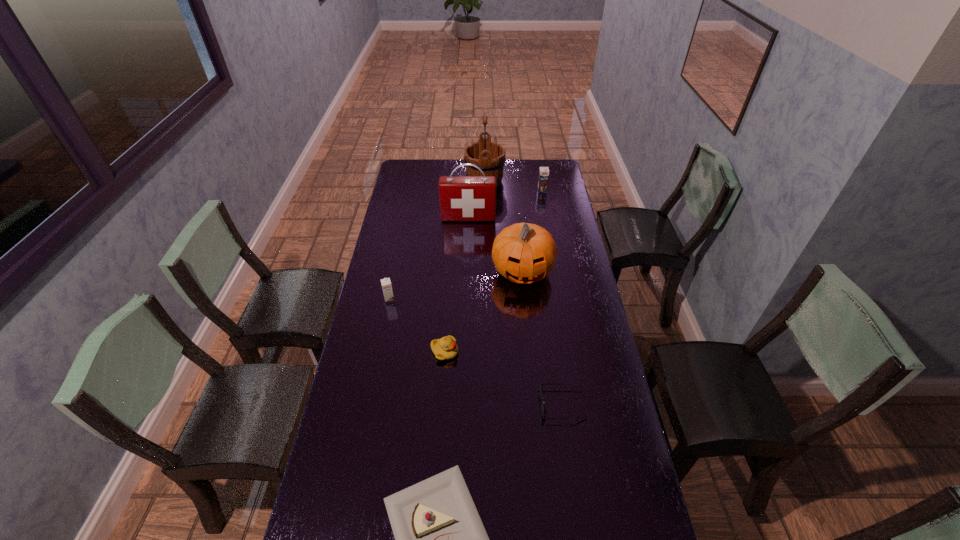
At what (x,y) coordinates should I click in order to perform the action: click on the second nearest object. Please return your answer as a coordinate pair (x, y). Image resolution: width=960 pixels, height=540 pixels. Looking at the image, I should click on (544, 411).

Locate an element on the screen. vacant space located on the left of the tallest object is located at coordinates (432, 181).

This screenshot has width=960, height=540. Find the location of `vacant point located 0.370m on the front face of the third farthest object`. vacant point located 0.370m on the front face of the third farthest object is located at coordinates (467, 278).

Locate an element on the screen. vacant space situated 0.190m on the front-facing side of the fourth farthest object is located at coordinates (528, 332).

You are a GUI agent. You are given a task and a screenshot of the screen. Output one action in this format:
    pyautogui.click(x=<x>, y=<y>)
    Task: Click on the free space located 0.220m on the front label of the taller chocolate milk
    This screenshot has height=540, width=960.
    Given the screenshot: What is the action you would take?
    pyautogui.click(x=547, y=219)

Find the location of `free spot located on the back of the left chocolate milk`. free spot located on the back of the left chocolate milk is located at coordinates (396, 269).

Locate an element on the screen. vacant region located 0.270m on the front-facing side of the duckling is located at coordinates (x=537, y=352).

I want to click on blank space located on the front-facing side of the sunglasses, so click(x=436, y=404).

Where is `free space located on the front-facing side of the sunglasses`? free space located on the front-facing side of the sunglasses is located at coordinates (505, 404).

The image size is (960, 540). Identify the location of vacant space positioned 0.230m on the front-facing side of the sunglasses. (468, 404).